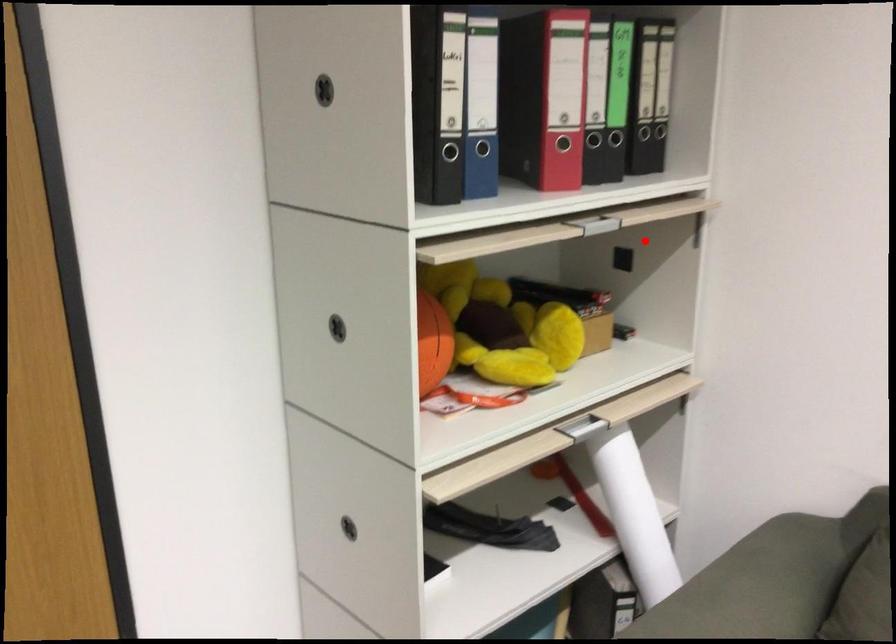
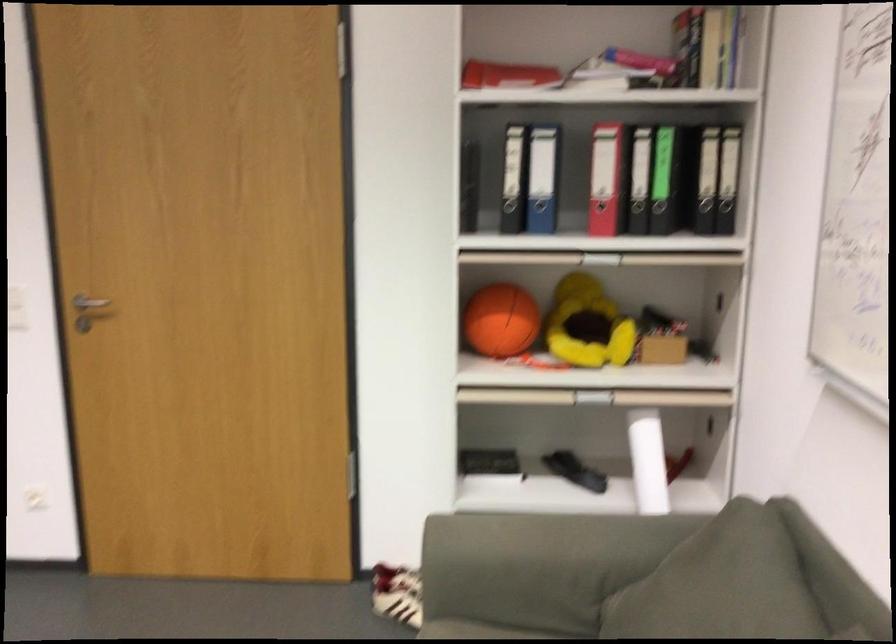
Question: I am providing you with two images of the same scene from different viewpoints. Given a red point in image1, look at the same physical point in image2. Is it:

Choices:
 (A) Closer to the viewpoint
 (B) Farther from the viewpoint

Answer: (B)